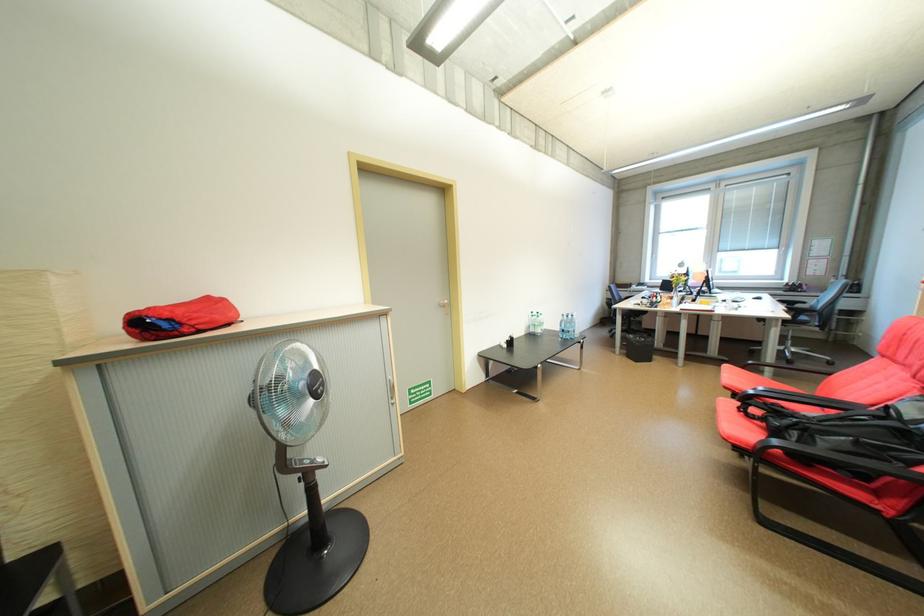
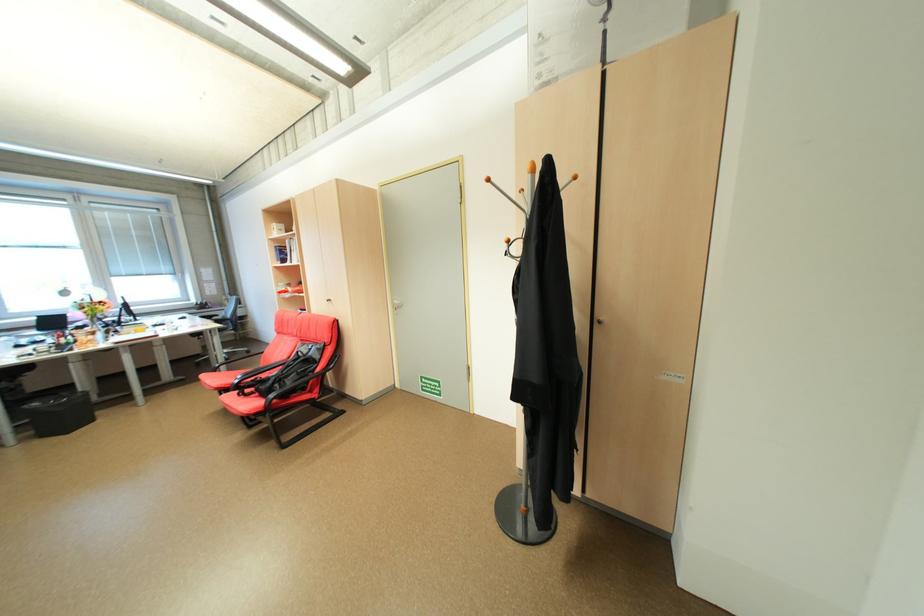
Locate, in the second image, the point that corresponds to point 805,434 in the first image.

(286, 386)